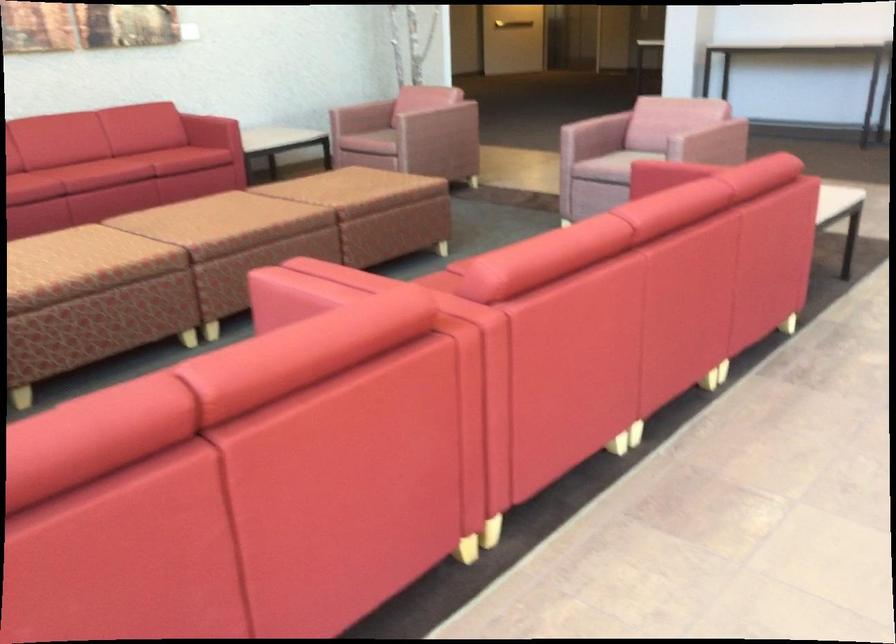
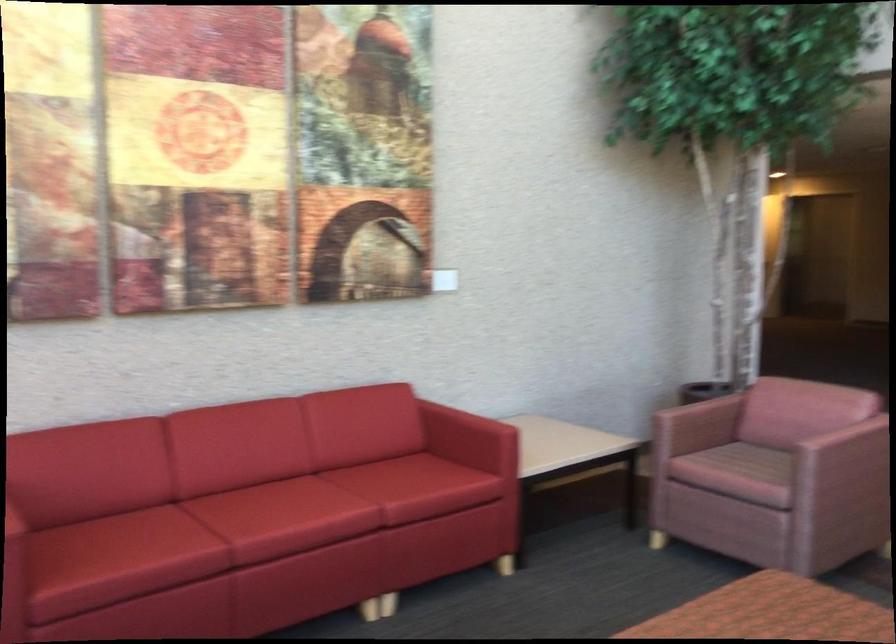
Where in the second image is the point corresponding to pixel 142 162 from the first image?

(363, 533)